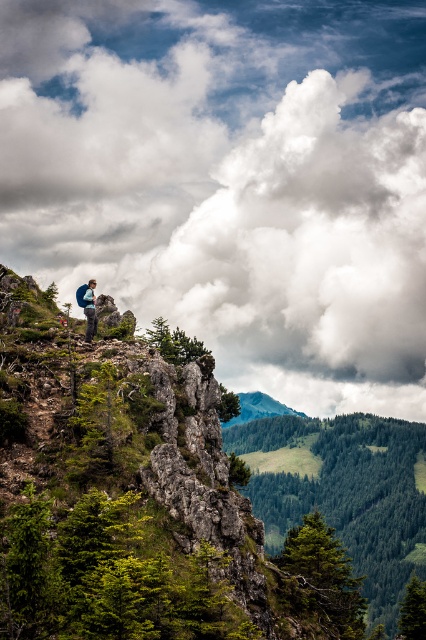
Is white fluffy cloud at upper center smaller than green grassy hillside at center?

Incorrect, white fluffy cloud at upper center is not smaller in size than green grassy hillside at center.

Is white fluffy cloud at upper center further to camera compared to green grassy hillside at center?

Yes, white fluffy cloud at upper center is behind green grassy hillside at center.

Is point (242, 68) in front of point (371, 616)?

No.

Image resolution: width=426 pixels, height=640 pixels. What are the coordinates of `white fluffy cloud at upper center` in the screenshot? It's located at (230, 179).

Who is more forward, (353, 474) or (230, 420)?

Point (353, 474) is more forward.

Is green grassy hillside at center below green grassy mountain at center?

Yes, green grassy hillside at center is below green grassy mountain at center.

In order to click on green grassy hillside at center in this screenshot , I will do `click(347, 493)`.

Can you confirm if white fluffy cloud at upper center is taller than green grassy mountain at center?

Yes.

Between white fluffy cloud at upper center and green grassy mountain at center, which one has more height?

With more height is white fluffy cloud at upper center.

What are the coordinates of `white fluffy cloud at upper center` in the screenshot? It's located at (230, 179).